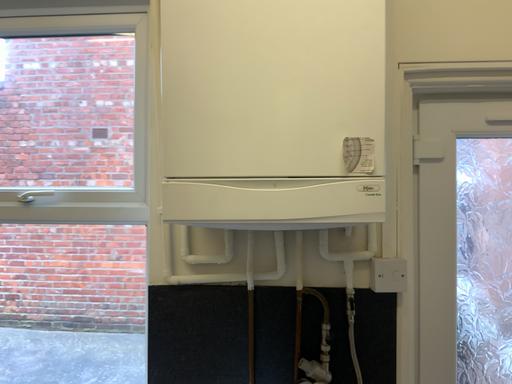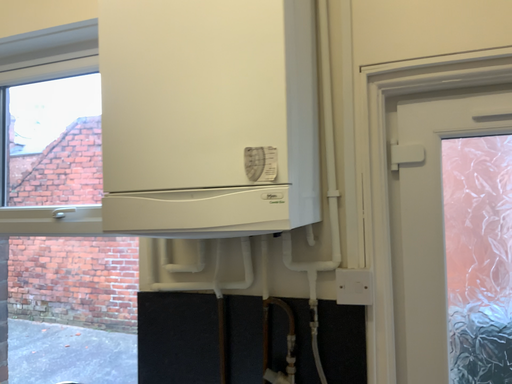
Question: How did the camera likely rotate when shooting the video?

Choices:
 (A) rotated right
 (B) rotated left

Answer: (B)